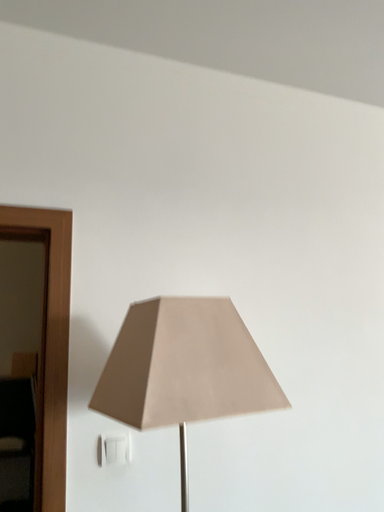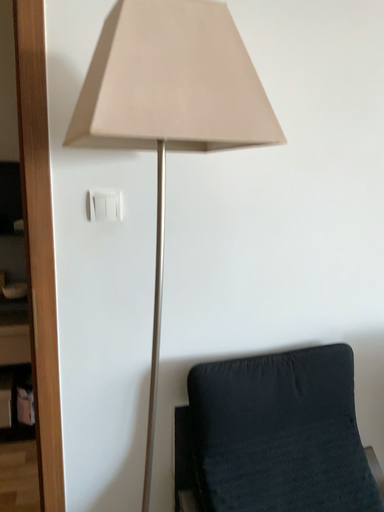
Question: Which way did the camera rotate in the video?

Choices:
 (A) rotated downward
 (B) rotated upward

Answer: (A)